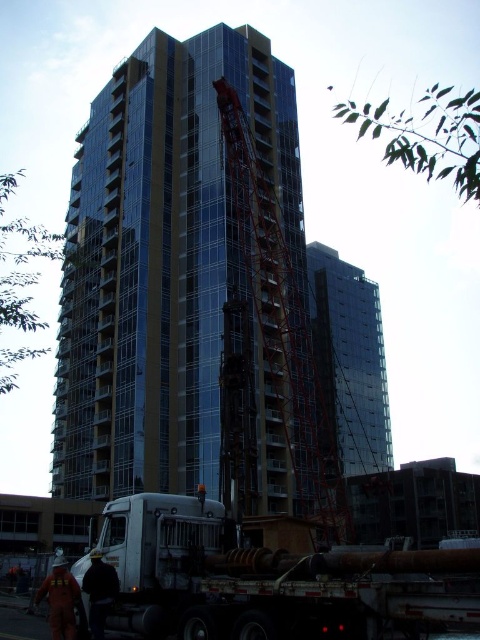
Question: Estimate the real-world distances between objects in this image. Which object is closer to the glassy steel building at center?

Choices:
 (A) white matte trailer truck at lower left
 (B) reddish metallic crane at center
 (C) dark gray fabric jacket at lower left

Answer: (B)

Question: Among these points, which one is nearest to the camera?

Choices:
 (A) (304, 310)
 (B) (40, 593)
 (C) (286, 196)
 (D) (108, 541)

Answer: (B)

Question: Which is farther from the white matte trailer truck at lower left?

Choices:
 (A) orange reflective suit at lower left
 (B) dark gray fabric jacket at lower left
 (C) glassy steel building at center
 (D) reddish metallic crane at center

Answer: (C)

Question: In this image, where is white matte trailer truck at lower left located relative to dark gray fabric jacket at lower left?

Choices:
 (A) below
 (B) above

Answer: (A)

Question: Is glassy steel building at center above reddish metallic crane at center?

Choices:
 (A) no
 (B) yes

Answer: (B)

Question: Can you confirm if white matte trailer truck at lower left is wider than orange reflective suit at lower left?

Choices:
 (A) no
 (B) yes

Answer: (B)